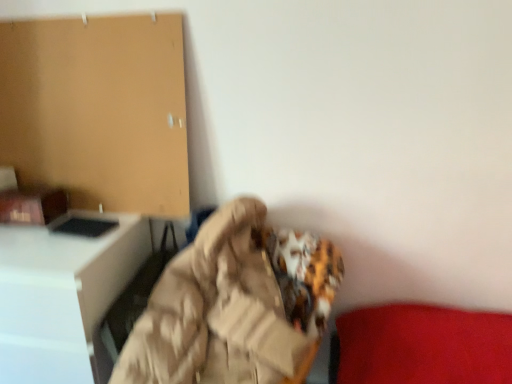
Locate an element on the screen. The width and height of the screenshot is (512, 384). beige fabric bean bag chair at center is located at coordinates 234,306.

What do you see at coordinates (234, 306) in the screenshot?
I see `beige fabric bean bag chair at center` at bounding box center [234, 306].

Identify the location of white glossy desk at left. (63, 298).

Measure the distance between white glossy desk at left and camera.

white glossy desk at left is 4.05 feet from camera.

Image resolution: width=512 pixels, height=384 pixels. Describe the element at coordinates (63, 298) in the screenshot. I see `white glossy desk at left` at that location.

Find the location of a particular element. beige fabric bean bag chair at center is located at coordinates (234, 306).

Does white glossy desk at left appear on the left side of beige fabric bean bag chair at center?

Correct, you'll find white glossy desk at left to the left of beige fabric bean bag chair at center.

Is the depth of white glossy desk at left greater than that of beige fabric bean bag chair at center?

Yes, white glossy desk at left is further from the viewer.

Consider the image. Which is farther, (45, 280) or (225, 356)?

The point (45, 280) is behind.

Based on the photo, from the image's perspective, is white glossy desk at left located above or below beige fabric bean bag chair at center?

From the image's perspective, white glossy desk at left appears below beige fabric bean bag chair at center.

From a real-world perspective, which object rests below the other?

white glossy desk at left is physically lower.

Considering the sizes of objects white glossy desk at left and beige fabric bean bag chair at center in the image provided, who is thinner, white glossy desk at left or beige fabric bean bag chair at center?

With smaller width is white glossy desk at left.

In terms of height, does white glossy desk at left look taller or shorter compared to beige fabric bean bag chair at center?

In the image, white glossy desk at left appears to be taller than beige fabric bean bag chair at center.

Who is smaller, white glossy desk at left or beige fabric bean bag chair at center?

beige fabric bean bag chair at center.

Is beige fabric bean bag chair at center surrounded by white glossy desk at left?

No, white glossy desk at left does not contain beige fabric bean bag chair at center.

Is the surface of white glossy desk at left in direct contact with beige fabric bean bag chair at center?

No, white glossy desk at left is not beside beige fabric bean bag chair at center.

Is white glossy desk at left facing away from beige fabric bean bag chair at center?

No, beige fabric bean bag chair at center is not at the back of white glossy desk at left.

Can you tell me how much white glossy desk at left and beige fabric bean bag chair at center differ in facing direction?

6.34 degrees.

Where is `bean bag chair above the white glossy desk at left (from a real-world perspective)`? The image size is (512, 384). bean bag chair above the white glossy desk at left (from a real-world perspective) is located at coordinates pyautogui.click(x=234, y=306).

Based on their positions, is beige fabric bean bag chair at center located to the left or right of white glossy desk at left?

Clearly, beige fabric bean bag chair at center is on the right of white glossy desk at left in the image.

Is beige fabric bean bag chair at center positioned behind white glossy desk at left?

No.

Is point (340, 277) more distant than point (75, 376)?

That is True.

From the image's perspective, is beige fabric bean bag chair at center beneath white glossy desk at left?

Actually, beige fabric bean bag chair at center appears above white glossy desk at left in the image.

From a real-world perspective, is beige fabric bean bag chair at center physically above white glossy desk at left?

Yes, from a real-world perspective, beige fabric bean bag chair at center is on top of white glossy desk at left.

Is beige fabric bean bag chair at center wider or thinner than white glossy desk at left?

Considering their sizes, beige fabric bean bag chair at center looks broader than white glossy desk at left.

From the picture: Does beige fabric bean bag chair at center have a greater height compared to white glossy desk at left?

No.

Based on their sizes in the image, would you say beige fabric bean bag chair at center is bigger or smaller than white glossy desk at left?

Considering their sizes, beige fabric bean bag chair at center takes up less space than white glossy desk at left.

Do you think beige fabric bean bag chair at center is within white glossy desk at left, or outside of it?

beige fabric bean bag chair at center cannot be found inside white glossy desk at left.

Is beige fabric bean bag chair at center beside white glossy desk at left?

No, beige fabric bean bag chair at center is not next to white glossy desk at left.

Is beige fabric bean bag chair at center facing towards white glossy desk at left?

No, beige fabric bean bag chair at center is not turned towards white glossy desk at left.

How many degrees apart are the facing directions of beige fabric bean bag chair at center and white glossy desk at left?

There is a 6.34-degree angle between the facing directions of beige fabric bean bag chair at center and white glossy desk at left.

Find the location of a particular element. furniture that appears on the left of beige fabric bean bag chair at center is located at coordinates (63, 298).

Locate an element on the screen. bean bag chair above the white glossy desk at left (from a real-world perspective) is located at coordinates (234, 306).

Find the location of a particular element. The height and width of the screenshot is (384, 512). furniture on the left of the beige fabric bean bag chair at center is located at coordinates (63, 298).